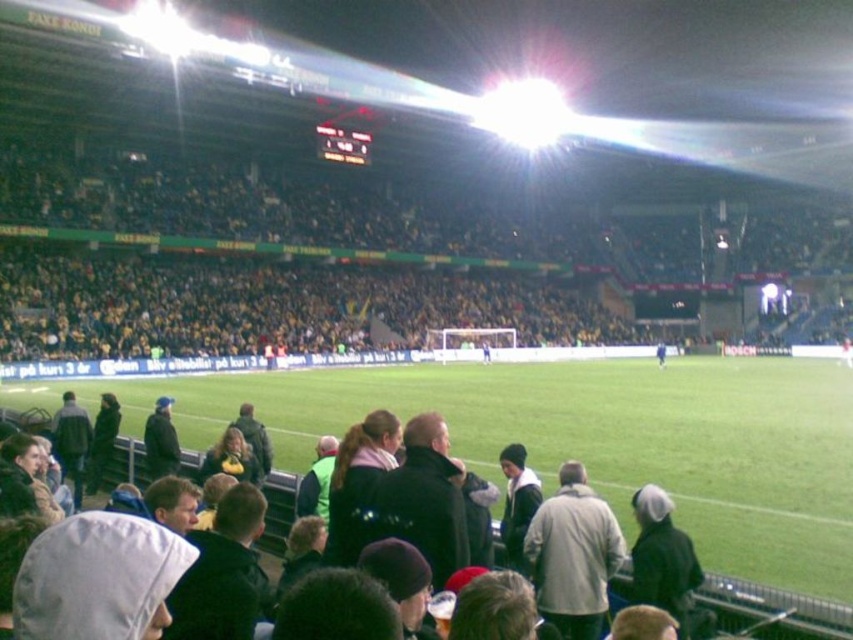
Question: Does yellow jersey at upper center come behind dark gray hooded sweatshirt at lower left?

Choices:
 (A) yes
 (B) no

Answer: (A)

Question: Observing the image, what is the correct spatial positioning of yellow jersey at upper center in reference to dark gray hooded sweatshirt at lower left?

Choices:
 (A) right
 (B) left

Answer: (A)

Question: Which object appears closest to the camera in this image?

Choices:
 (A) dark gray hooded sweatshirt at lower left
 (B) yellow jersey at upper center

Answer: (A)

Question: Which of the following is the farthest from the observer?

Choices:
 (A) (665, 552)
 (B) (96, 280)

Answer: (B)

Question: Observing the image, what is the correct spatial positioning of yellow jersey at upper center in reference to dark gray hooded sweatshirt at lower left?

Choices:
 (A) above
 (B) below

Answer: (A)